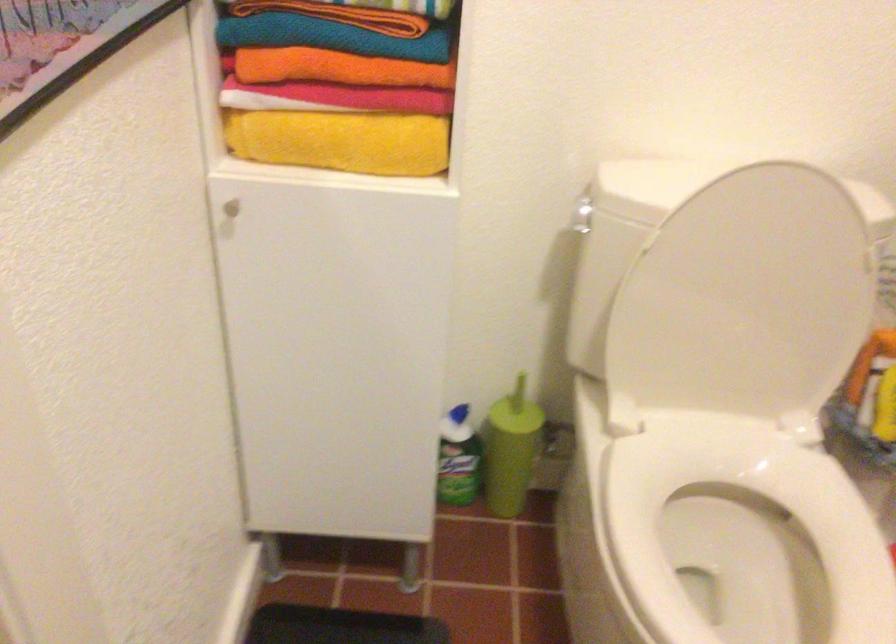
What are the coordinates of `white toilet lid` in the screenshot? It's located at (744, 299).